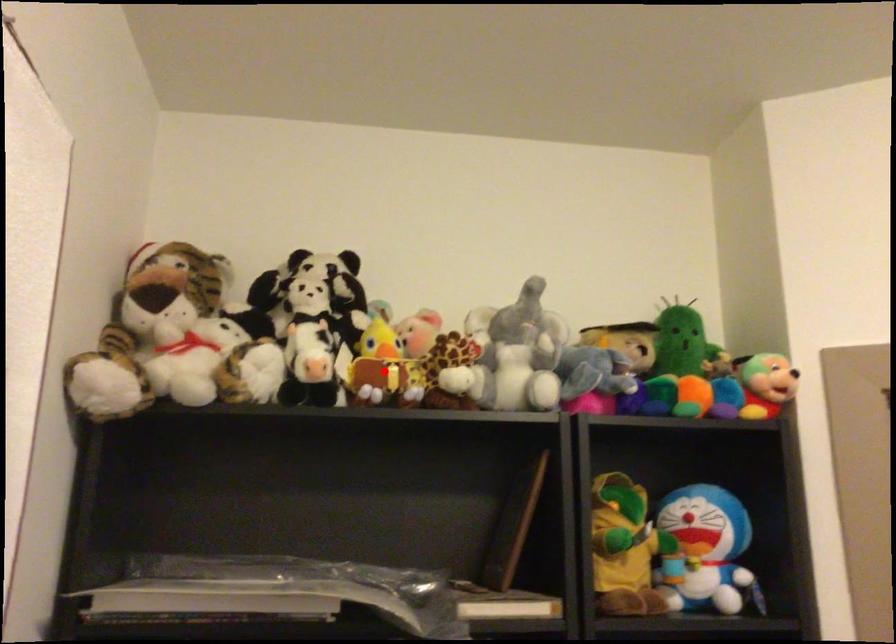
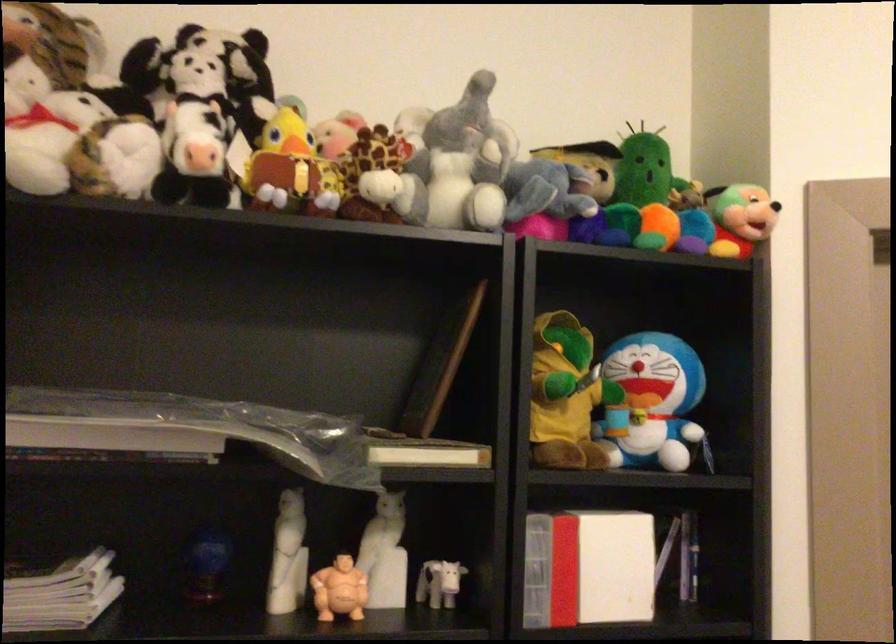
Locate, in the second image, the point that corresponds to the highlighted location in the first image.

(290, 169)